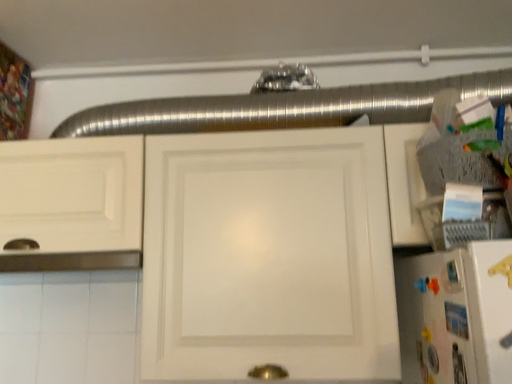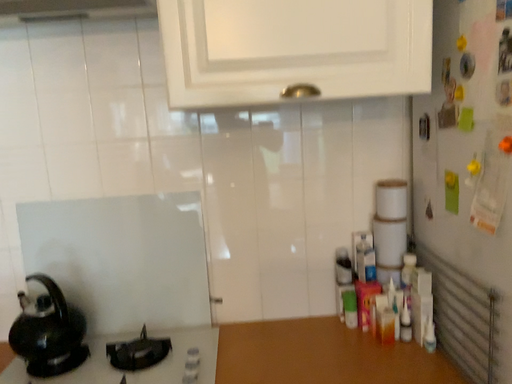
Question: Which way did the camera rotate in the video?

Choices:
 (A) rotated left
 (B) rotated right

Answer: (B)